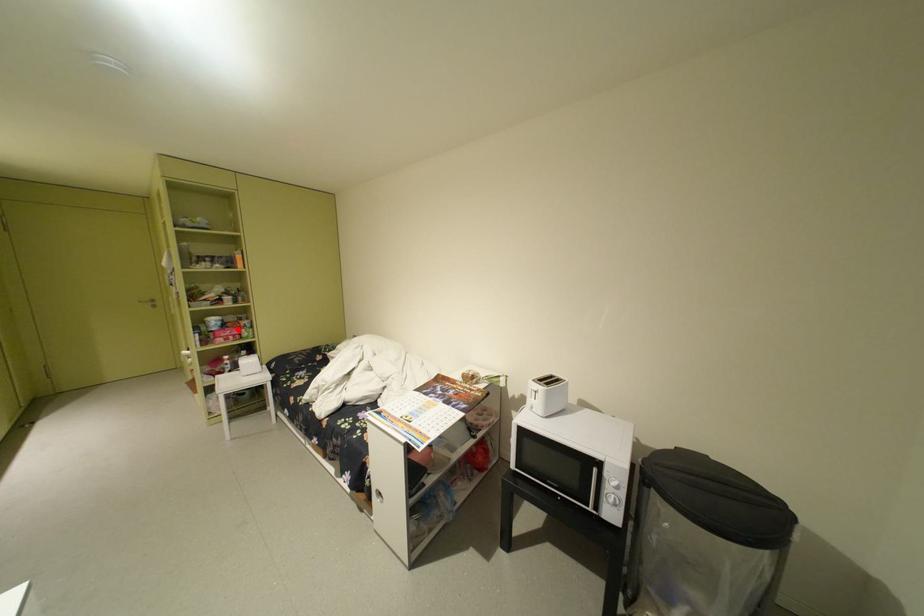
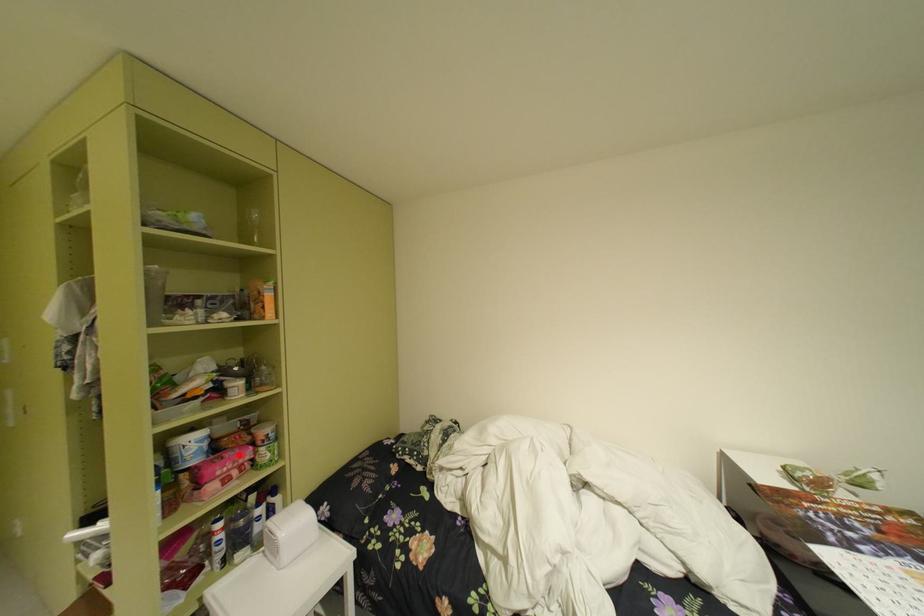
I am providing you with two images of the same scene from different viewpoints. A red point is marked on the first image and another point is marked on the second image. Is the marked point in image1 the same physical position as the marked point in image2?

Yes